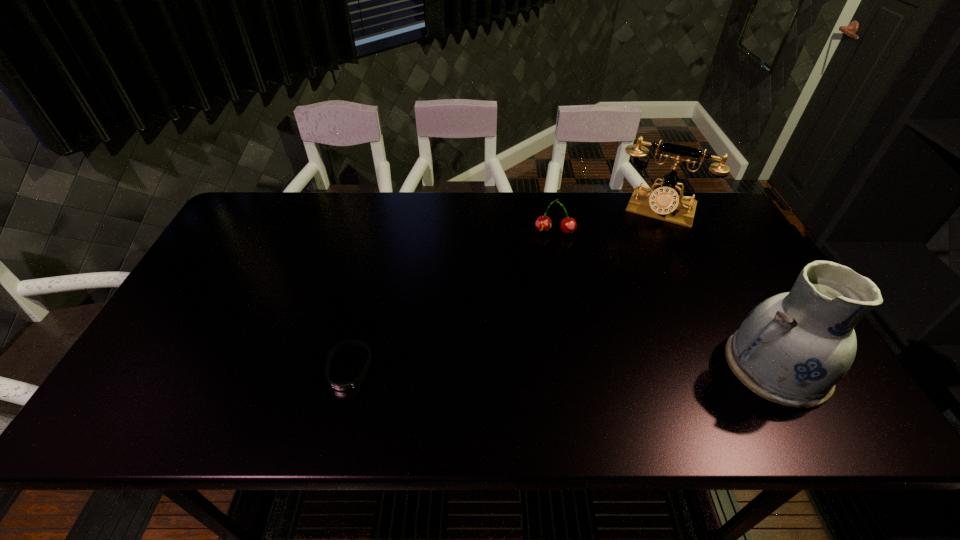
Where is `object at the near right corner`? object at the near right corner is located at coordinates (793, 348).

In the image, there is a desktop. Where is `free space at the far edge`? free space at the far edge is located at coordinates (309, 225).

In order to click on vacant space at the near edge of the desktop in this screenshot , I will do (x=352, y=367).

Locate an element on the screen. This screenshot has height=540, width=960. vacant region at the left edge of the desktop is located at coordinates (252, 248).

Identify the location of vacant space at the right edge. (718, 283).

This screenshot has height=540, width=960. I want to click on vacant space that's between the cherry and the leftmost object, so click(x=452, y=300).

Where is `empty space between the tallest object and the wristband`? The image size is (960, 540). empty space between the tallest object and the wristband is located at coordinates (563, 367).

What are the coordinates of `empty space that is in between the leftmost object and the second tallest object` in the screenshot? It's located at (504, 289).

You are a GUI agent. You are given a task and a screenshot of the screen. Output one action in this format:
    pyautogui.click(x=<x>, y=<y>)
    Task: Click on the unoccupied area between the third object from right to left and the telephone
    The height and width of the screenshot is (540, 960).
    Given the screenshot: What is the action you would take?
    pyautogui.click(x=607, y=220)

The width and height of the screenshot is (960, 540). I want to click on unoccupied position between the third shortest object and the pottery, so click(717, 288).